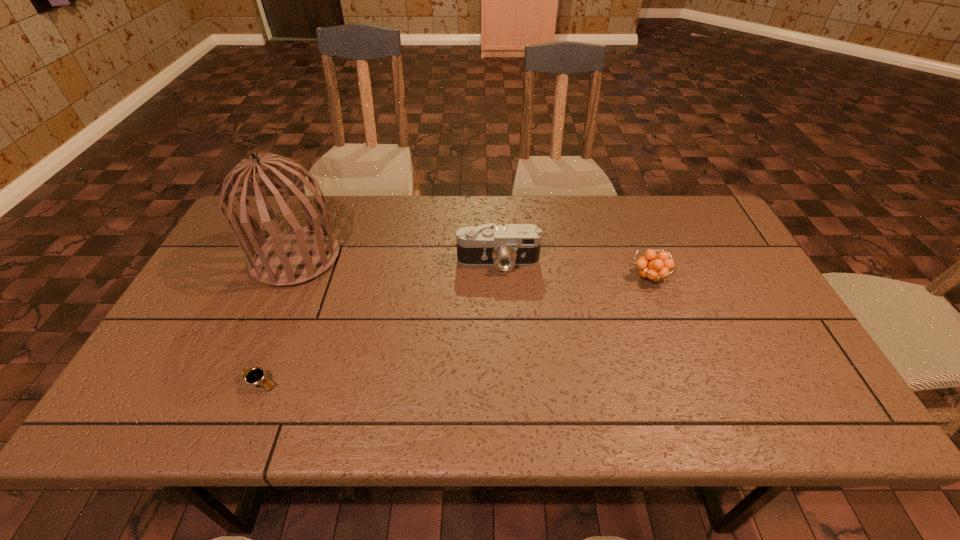
Where is `vacant space located 0.160m on the left of the shortest object`? vacant space located 0.160m on the left of the shortest object is located at coordinates (169, 383).

The image size is (960, 540). Identify the location of object that is at the far edge. (296, 255).

Identify the location of object that is at the near edge. The height and width of the screenshot is (540, 960). (252, 376).

Image resolution: width=960 pixels, height=540 pixels. I want to click on object that is at the left edge, so click(x=296, y=255).

Locate an element on the screen. The height and width of the screenshot is (540, 960). object that is at the far left corner is located at coordinates (296, 255).

Locate an element on the screen. free space at the far edge is located at coordinates (349, 206).

In the image, there is a desktop. Where is `free region at the near edge`? The width and height of the screenshot is (960, 540). free region at the near edge is located at coordinates (409, 423).

Identify the location of free spot at the left edge of the desktop. The height and width of the screenshot is (540, 960). (226, 287).

Where is `vacant space at the right edge of the desktop`? Image resolution: width=960 pixels, height=540 pixels. vacant space at the right edge of the desktop is located at coordinates (728, 270).

Find the location of `free space at the far right corner of the desktop`. free space at the far right corner of the desktop is located at coordinates (706, 214).